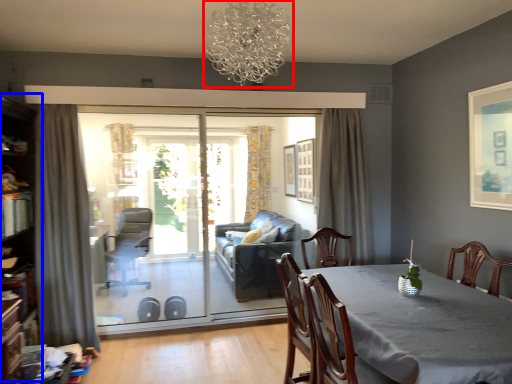
Question: Which of the following is the farthest to the observer, light fixture (highlighted by a red box) or bookshelf (highlighted by a blue box)?

Choices:
 (A) light fixture
 (B) bookshelf

Answer: (B)